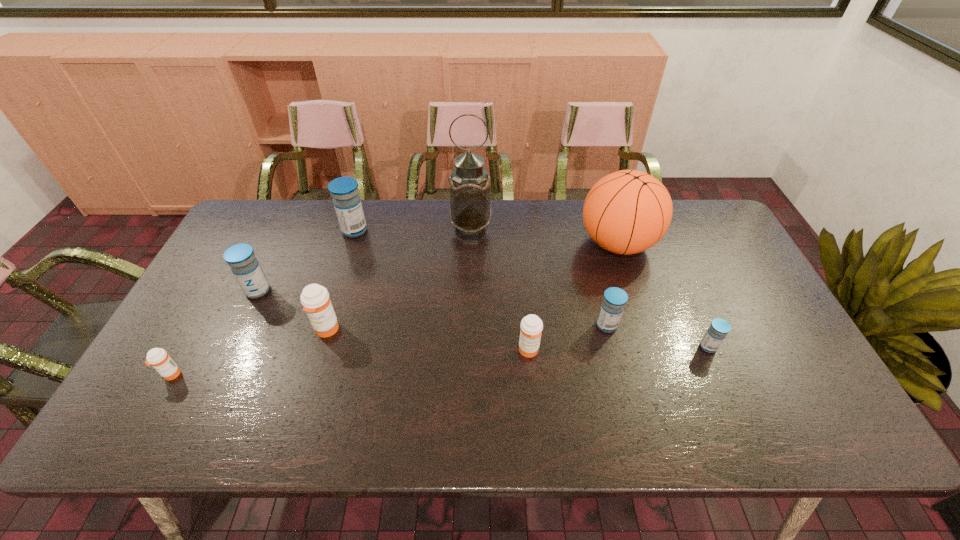
Find the location of a particular element. vacant area between the basketball and the oil lamp is located at coordinates (544, 236).

At what (x,y) coordinates should I click in order to perform the action: click on free point between the nearest orange medicine and the rightmost blue medicine. Please return your answer as a coordinate pair (x, y). Image resolution: width=960 pixels, height=540 pixels. Looking at the image, I should click on (440, 361).

The width and height of the screenshot is (960, 540). In order to click on vacant area between the third biggest blue medicine and the nearest object in this screenshot , I will do `click(389, 350)`.

In order to click on free spot between the nearest medicine and the second smallest orange medicine in this screenshot , I will do `click(350, 362)`.

Choose which object is the sixth nearest neighbor to the second object from left to right. Please provide its 2D coordinates. Your answer should be formatted as a tuple, i.e. [(x, y)], where the tuple contains the x and y coordinates of a point satisfying the conditions above.

[(614, 300)]

Locate an element on the screen. object that is the sixth closest to the smallest blue medicine is located at coordinates (347, 202).

Identify the location of medicine that is the closest one to the third blue medicine from left to right. (531, 325).

Locate an element on the screen. The height and width of the screenshot is (540, 960). medicine that stands as the sixth closest to the rightmost medicine is located at coordinates (158, 358).

Select which blue medicine appears as the closest to the oil lamp. Please provide its 2D coordinates. Your answer should be formatted as a tuple, i.e. [(x, y)], where the tuple contains the x and y coordinates of a point satisfying the conditions above.

[(347, 202)]

The width and height of the screenshot is (960, 540). What are the coordinates of `blue medicine that is the third closest to the fourth object from right to left` in the screenshot? It's located at (347, 202).